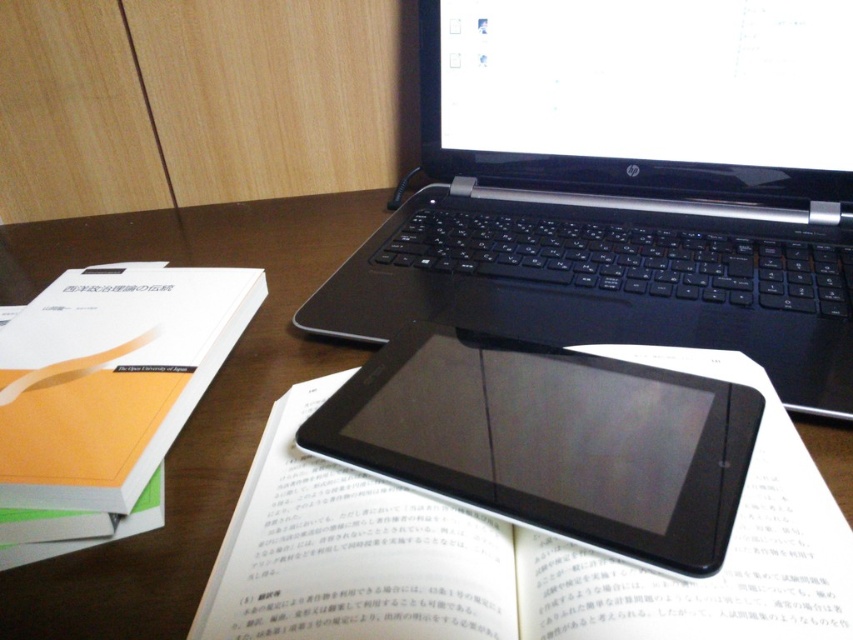
Question: Which point is farther from the camera taking this photo?

Choices:
 (A) (659, 465)
 (B) (822, 433)

Answer: (B)

Question: Which of the following is the farthest from the observer?

Choices:
 (A) black plastic tablet at center
 (B) white matte book at left

Answer: (B)

Question: Is black plastic tablet at center smaller than brown wooden table at center?

Choices:
 (A) no
 (B) yes

Answer: (B)

Question: Can you confirm if black plastic laptop at upper center is smaller than brown wooden table at center?

Choices:
 (A) yes
 (B) no

Answer: (A)

Question: Does black plastic laptop at upper center come in front of black plastic tablet at center?

Choices:
 (A) no
 (B) yes

Answer: (A)

Question: Among these points, which one is nearest to the camera?

Choices:
 (A) (376, 209)
 (B) (454, 317)

Answer: (B)